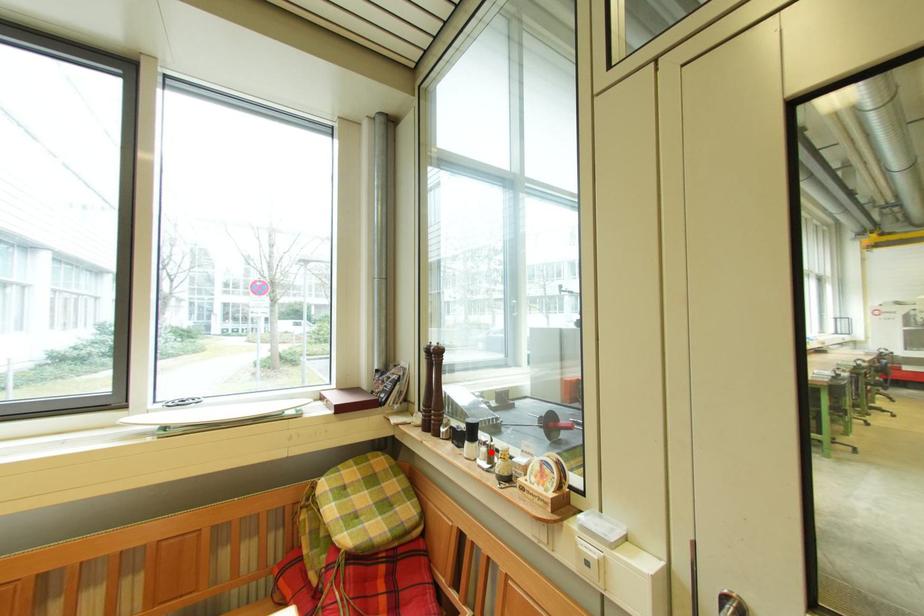
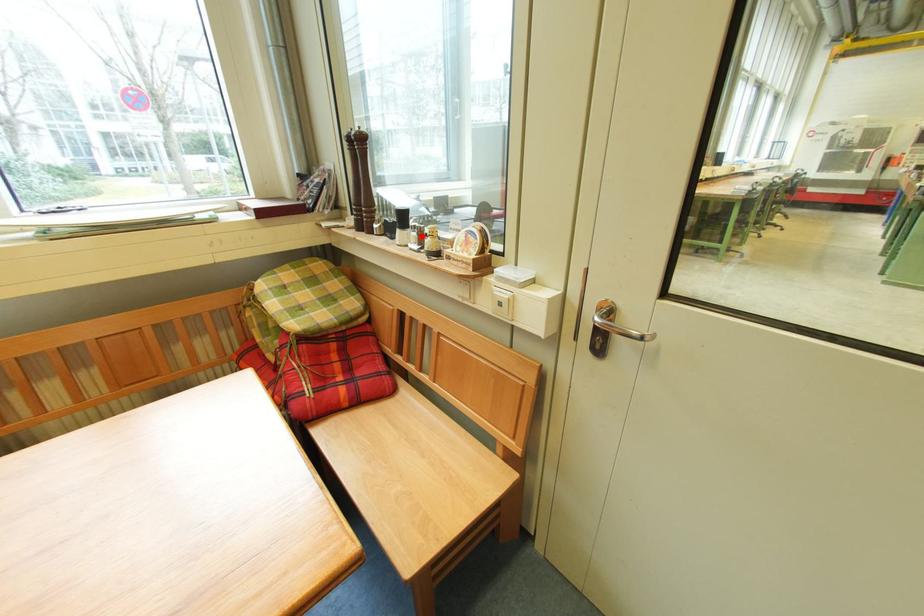
From the picture: I am providing you with two images of the same scene from different viewpoints. A red point is marked on the first image and another point is marked on the second image. Is the marked point in image1 the same physical position as the marked point in image2?

Yes